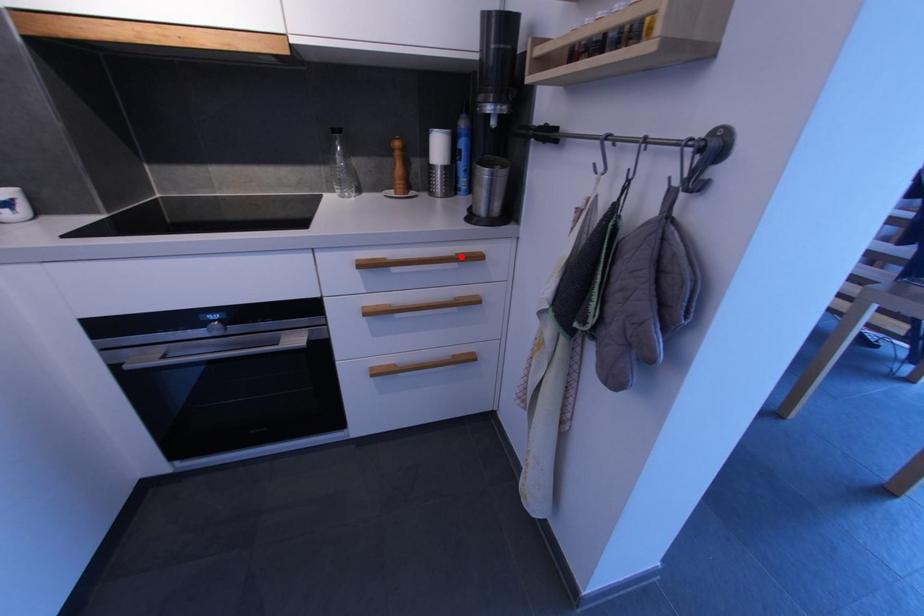
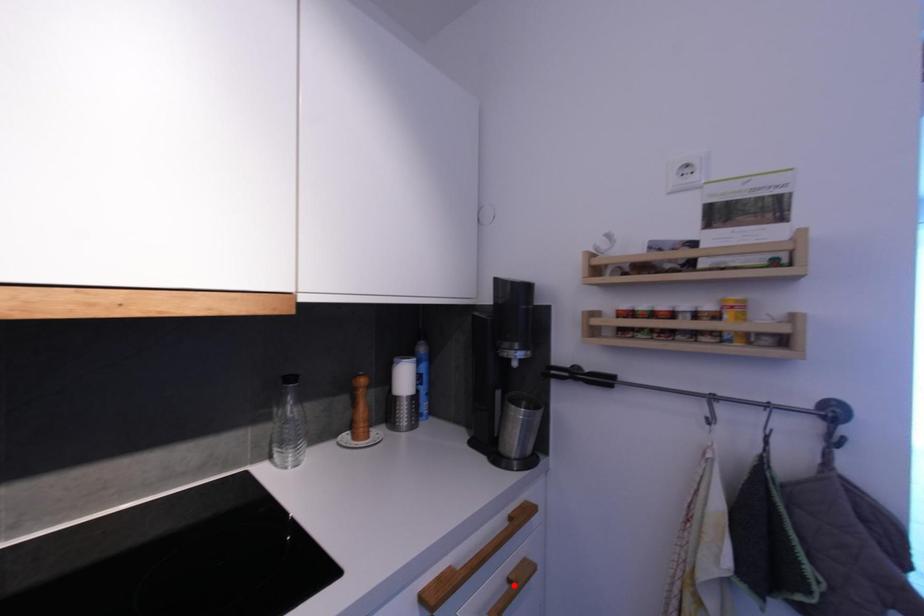
I am providing you with two images of the same scene from different viewpoints. A red point is marked on the first image and another point is marked on the second image. Do the highlighted points in image1 and image2 indicate the same real-world spot?

No